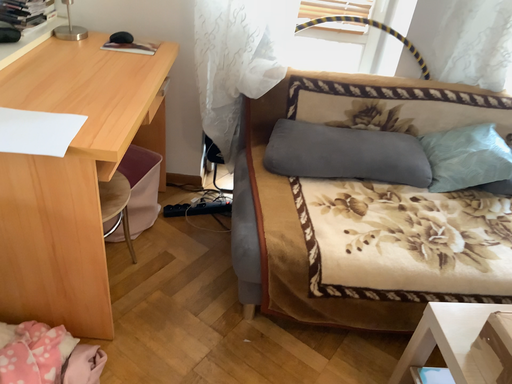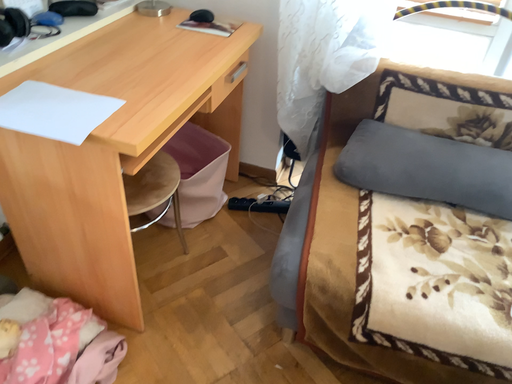
Question: How did the camera likely rotate when shooting the video?

Choices:
 (A) rotated right
 (B) rotated left

Answer: (B)